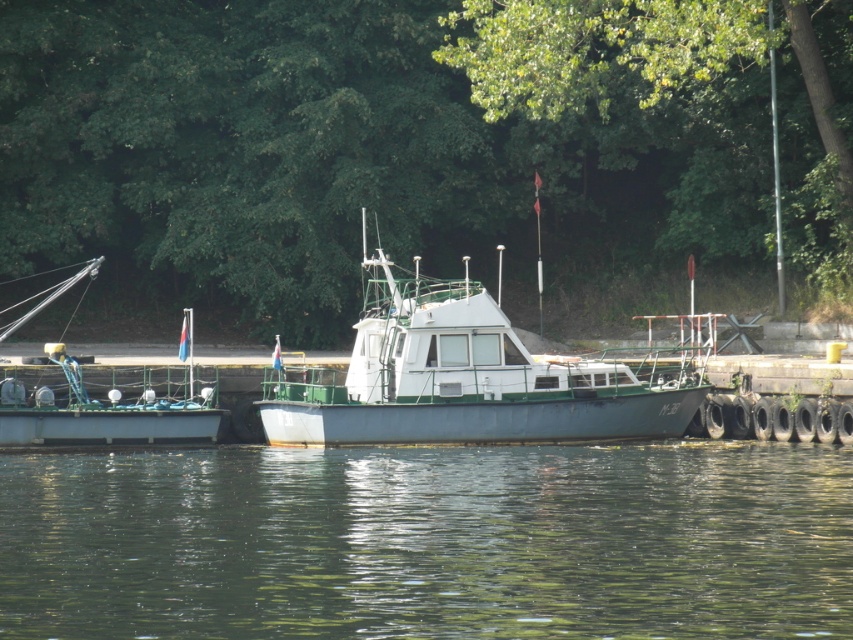
You are standing on the pier and want to board a boat. The greenish water at lower center is wider than the green matte boat at left. Which boat should you choose if you want to board the larger vessel?

The greenish water at lower center is wider than the green matte boat at left, so you should choose the greenish water at lower center as it is the larger vessel.

You are a photographer planning to capture the white matte boat at center and the green leafy tree at upper center in a single frame. Based on their sizes in the image, which object would appear larger in your photo?

The white matte boat at center would appear larger in the photo because the green leafy tree at upper center is taller than it, but since the tree is positioned further away, its apparent size might be smaller due to distance. However, according to the given description, the tree is explicitly stated to be taller, but without information about their distances, we can only confirm the tree is taller in actual size, not necessarily in the image. The question asks about their sizes in the image, so the answer

In the scene shown: You are standing on the pier and looking at the green leafy tree at upper center and the white matte boat at center. Which object is higher from the ground?

The green leafy tree at upper center is higher from the ground than the white matte boat at center because it is positioned above it in the scene.